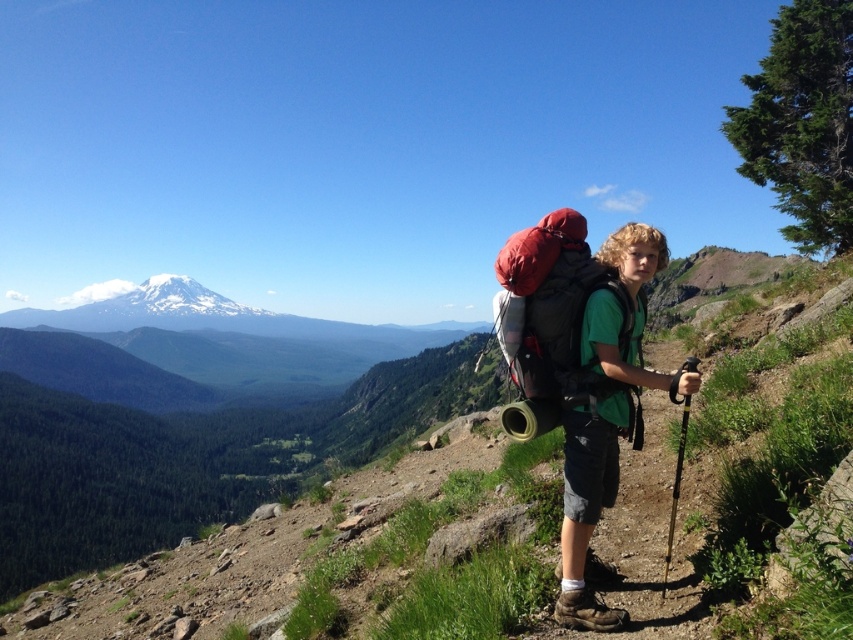
Question: Which of the following is the farthest from the observer?

Choices:
 (A) green fabric backpack at center
 (B) matte red backpack at center

Answer: (B)

Question: Can you confirm if green fabric backpack at center is positioned below matte red backpack at center?

Choices:
 (A) no
 (B) yes

Answer: (A)

Question: Does green fabric backpack at center have a greater width compared to matte red backpack at center?

Choices:
 (A) no
 (B) yes

Answer: (A)

Question: Considering the relative positions of green fabric backpack at center and matte red backpack at center in the image provided, where is green fabric backpack at center located with respect to matte red backpack at center?

Choices:
 (A) right
 (B) left

Answer: (B)